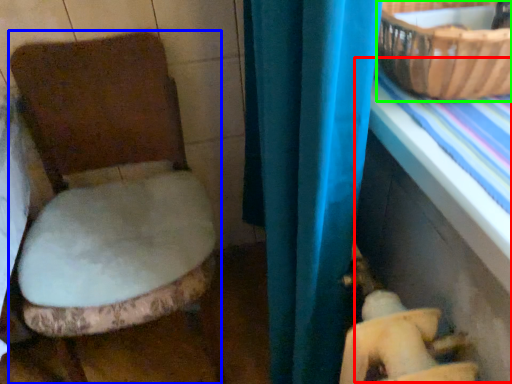
Question: Which object is positioned farthest from table (highlighted by a red box)? Select from toilet (highlighted by a blue box) and basket (highlighted by a green box).

Choices:
 (A) toilet
 (B) basket

Answer: (A)